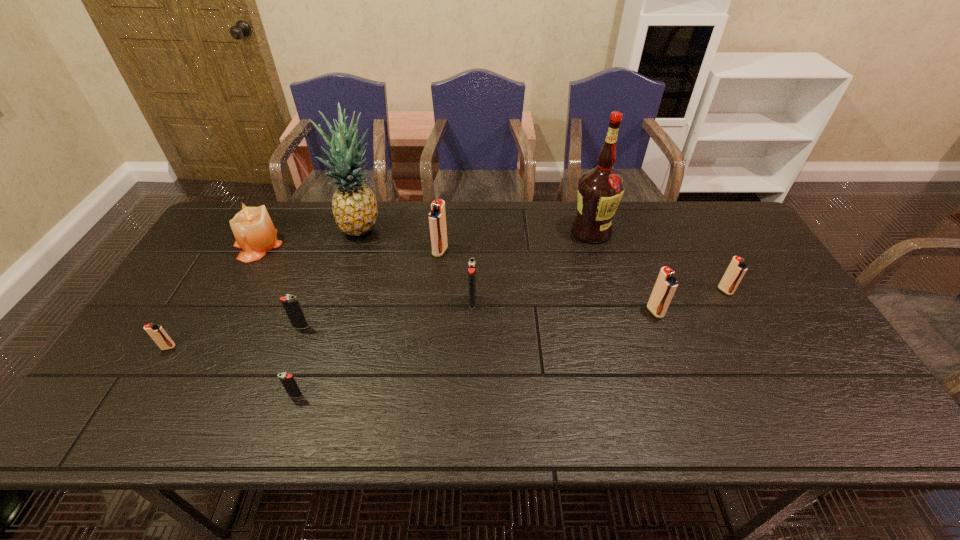
This screenshot has width=960, height=540. Find the location of `free space between the ninth object from left to right and the rightmost black igniter`. free space between the ninth object from left to right and the rightmost black igniter is located at coordinates (564, 307).

Point out which object is positioned as the second nearest to the alcohol. Please provide its 2D coordinates. Your answer should be formatted as a tuple, i.e. [(x, y)], where the tuple contains the x and y coordinates of a point satisfying the conditions above.

[(736, 269)]

Locate an element on the screen. The image size is (960, 540). object that is the fifth closest to the yellow pineapple is located at coordinates (156, 332).

Identify the location of the sixth closest igniter relative to the second smallest red igniter. (156, 332).

Identify which igniter is located as the third nearest to the fifth igniter from left to right. Please provide its 2D coordinates. Your answer should be formatted as a tuple, i.e. [(x, y)], where the tuple contains the x and y coordinates of a point satisfying the conditions above.

[(287, 380)]

Image resolution: width=960 pixels, height=540 pixels. I want to click on the second closest red igniter to the yellow pineapple, so click(x=156, y=332).

Select which red igniter appears as the fourth closest to the candle. Please provide its 2D coordinates. Your answer should be formatted as a tuple, i.e. [(x, y)], where the tuple contains the x and y coordinates of a point satisfying the conditions above.

[(736, 269)]

Choose which black igniter is the second nearest neighbor to the beige candle. Please provide its 2D coordinates. Your answer should be formatted as a tuple, i.e. [(x, y)], where the tuple contains the x and y coordinates of a point satisfying the conditions above.

[(287, 380)]

Identify which black igniter is located as the third nearest to the third farthest red igniter. Please provide its 2D coordinates. Your answer should be formatted as a tuple, i.e. [(x, y)], where the tuple contains the x and y coordinates of a point satisfying the conditions above.

[(291, 305)]

The image size is (960, 540). I want to click on free space that satisfies the following two spatial constraints: 1. on the label of the third farthest red igniter; 2. on the right side of the third object from right to left, so click(x=613, y=312).